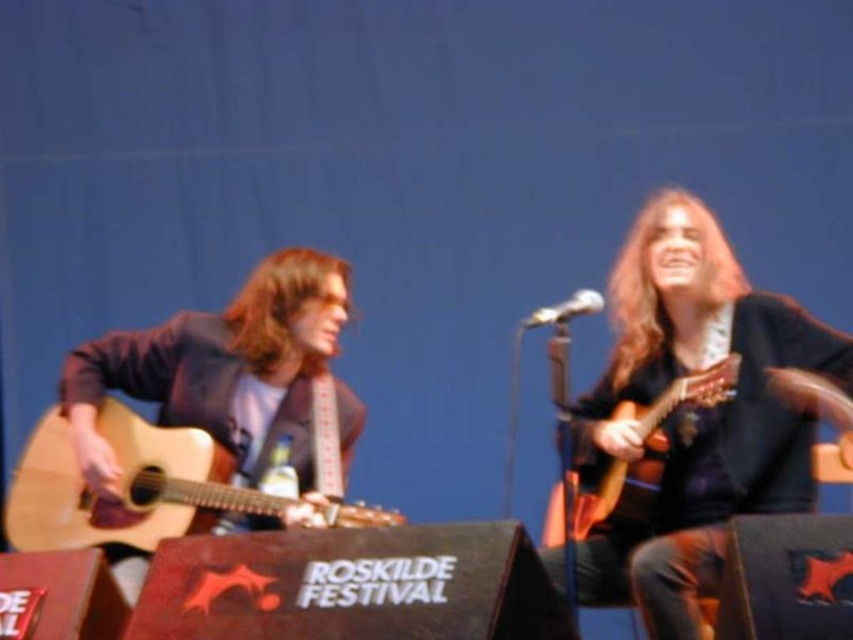
Is point (793, 449) positioned behind point (566, 317)?

Yes, it is.

Is matte black guitar at right thinner than metallic silver microphone at center?

Incorrect, matte black guitar at right's width is not less than metallic silver microphone at center's.

This screenshot has width=853, height=640. I want to click on matte black guitar at right, so click(x=695, y=412).

You are a GUI agent. You are given a task and a screenshot of the screen. Output one action in this format:
    pyautogui.click(x=<x>, y=<y>)
    Task: Click on the matte black guitar at right
    This screenshot has height=640, width=853.
    Given the screenshot: What is the action you would take?
    pyautogui.click(x=695, y=412)

Is matte black guitar at right to the left of matte brown guitar at left from the viewer's perspective?

Incorrect, matte black guitar at right is not on the left side of matte brown guitar at left.

Does matte black guitar at right appear over matte brown guitar at left?

Actually, matte black guitar at right is below matte brown guitar at left.

Where is `matte black guitar at right`? This screenshot has height=640, width=853. matte black guitar at right is located at coordinates (695, 412).

The image size is (853, 640). I want to click on matte black guitar at right, so click(x=695, y=412).

Does matte brown guitar at left have a lesser height compared to metallic silver microphone at center?

No, matte brown guitar at left is not shorter than metallic silver microphone at center.

Does matte brown guitar at left lie in front of metallic silver microphone at center?

No, it is not.

At what (x,y) coordinates should I click in order to perform the action: click on matte brown guitar at left. Please return your answer as a coordinate pair (x, y). Looking at the image, I should click on (219, 369).